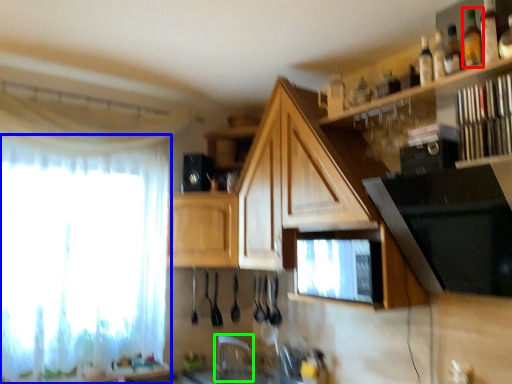
Question: Based on their relative distances, which object is nearer to bottle (highlighted by a red box)? Choose from curtain (highlighted by a blue box) and faucet (highlighted by a green box).

Choices:
 (A) curtain
 (B) faucet

Answer: (A)